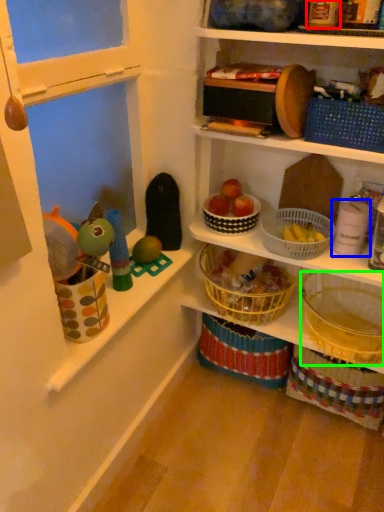
Question: Which object is positioned closest to toy (highlighted by a red box)? Select from toy (highlighted by a blue box) and basket (highlighted by a green box).

Choices:
 (A) toy
 (B) basket

Answer: (A)